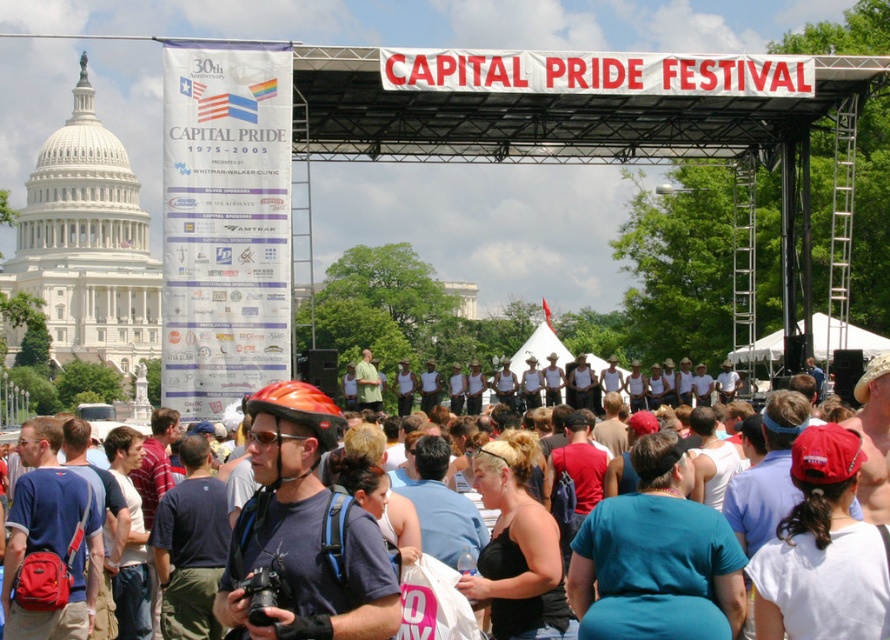
You are attending the Capital Pride Festival and want to take a photo of both the stage and the Capitol Building dome. You notice two points marked on the ground where you can stand. The first point is at coordinate point(634, 456) and the second is at point(267, 410). Based on their positions, which point would allow you to see both the stage and the Capitol Building dome clearly?

Point(634, 456) is behind point(267, 410). Since you want to see both the stage and the Capitol Building dome, you should choose the point that is in front of the other to have an unobstructed view. Therefore, standing at point(267, 410) would allow you to see both the stage and the Capitol Building dome clearly.

You are a photographer at the Capital Pride Festival. You want to take a photo that includes both the matte black tank tops at center and the matte orange helmet at center while also capturing the Capitol Building in the background. Given their distance apart, is it feasible to frame all three elements in a single shot without moving your position?

The matte black tank tops at center and matte orange helmet at center are 18.33 meters apart. Since the distance between them is significant, it might be challenging to frame both along with the Capitol Building in the background in a single shot without adjusting your position or using a wide angle lens. However, using a wide angle lens could allow capturing all elements if positioned correctly.

You are standing at the Capital Pride Festival, and you want to take a photo of the point at coordinates (474, 577). Given that you are 103.66 meters away from it, can you estimate how far you need to walk to reach that point?

The point at coordinates (474, 577) is 103.66 meters away from you, so you need to walk approximately 103.66 meters to reach it.